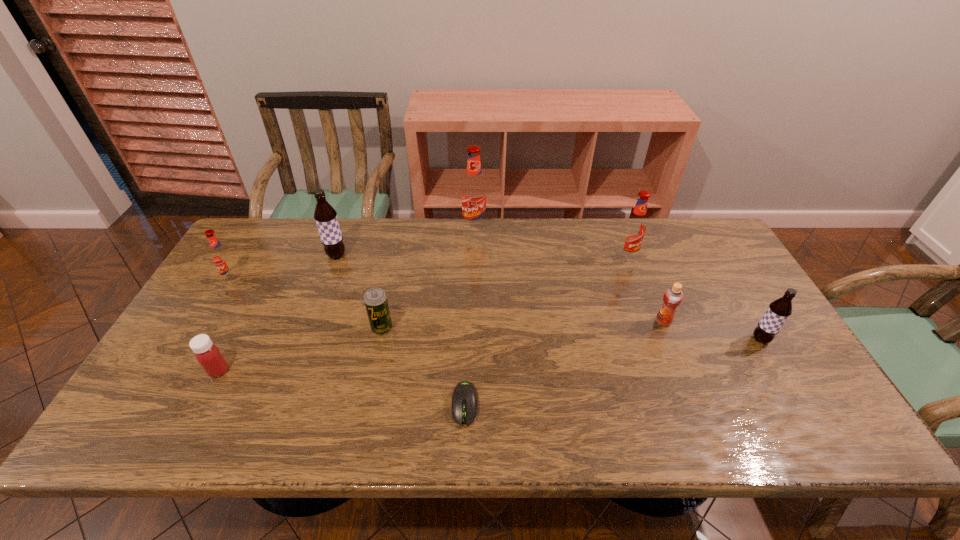
Find the location of `free region located 0.120m on the back of the smaller brown root beer`. free region located 0.120m on the back of the smaller brown root beer is located at coordinates (737, 300).

The width and height of the screenshot is (960, 540). Find the location of `free space located on the left of the orange juice`. free space located on the left of the orange juice is located at coordinates (549, 321).

Find the location of a particular element. This screenshot has width=960, height=540. free spot located on the back of the beer can is located at coordinates (396, 265).

Find the location of `blank space located on the right of the medicine`. blank space located on the right of the medicine is located at coordinates (378, 370).

At what (x,y) coordinates should I click in order to perform the action: click on object that is at the near edge. Please return your answer as a coordinate pair (x, y). This screenshot has height=540, width=960. Looking at the image, I should click on (464, 398).

Find the location of a particular element. root beer at the left edge is located at coordinates (221, 257).

At what (x,y) coordinates should I click in order to perform the action: click on medicine that is at the left edge. Please return your answer as a coordinate pair (x, y). Looking at the image, I should click on tap(207, 354).

In order to click on object positioned at the right edge in this screenshot , I will do `click(779, 310)`.

In the image, there is a desktop. Identify the location of vacant space at the far edge. The width and height of the screenshot is (960, 540). (640, 255).

This screenshot has height=540, width=960. I want to click on vacant region at the near edge of the desktop, so click(x=366, y=426).